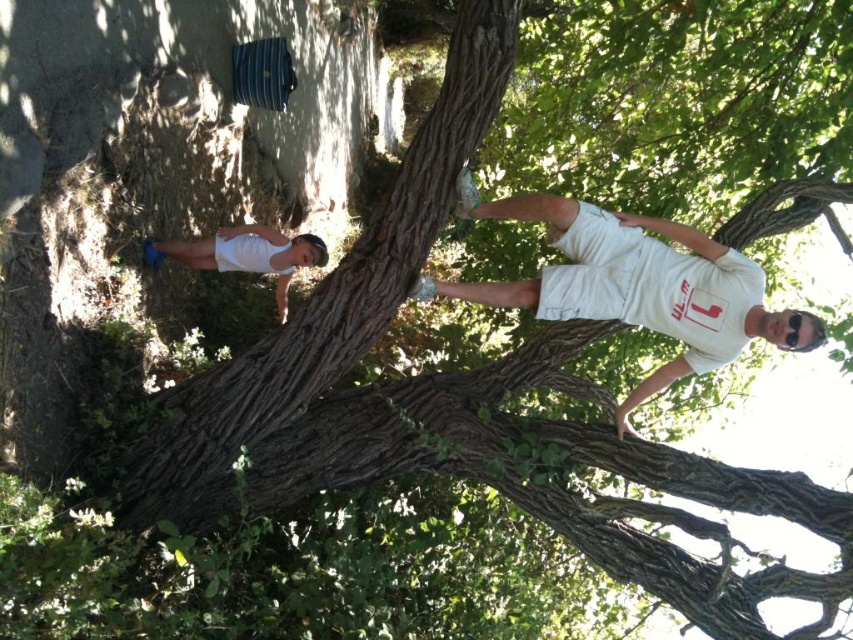
Is white cotton shirt at upper right shorter than white matte shorts at lower left?

No.

Does white cotton shirt at upper right have a greater width compared to white matte shorts at lower left?

Yes.

Is point (606, 291) in front of point (271, 237)?

Yes.

Image resolution: width=853 pixels, height=640 pixels. What are the coordinates of `white cotton shirt at upper right` in the screenshot? It's located at (637, 285).